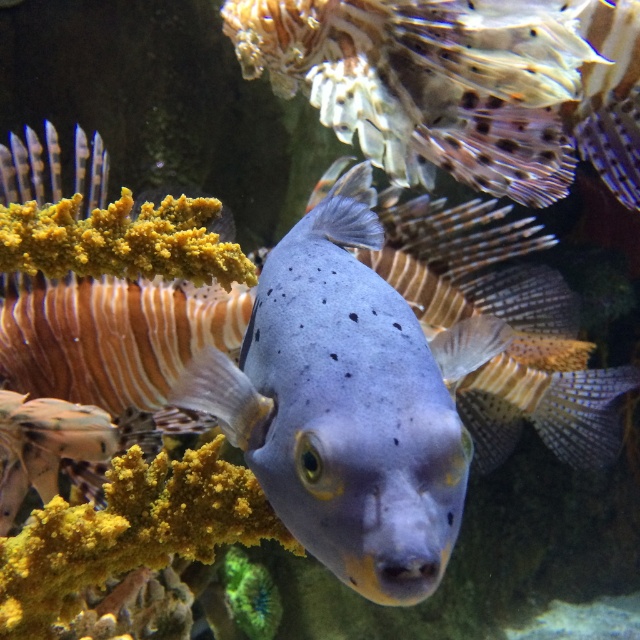
You are a marine biologist observing the underwater scene. You notice two fish at the center of the image. Which one is thinner between the smooth blue fish at center and the satin blue fish at center?

The smooth blue fish at center is thinner than the satin blue fish at center.

You are a marine biologist observing the underwater scene. You notice two fish at the center of the image. Which one is closer to you, the smooth blue fish at center or the satin blue fish at center?

The smooth blue fish at center is closer to you because it is in front of the satin blue fish at center.